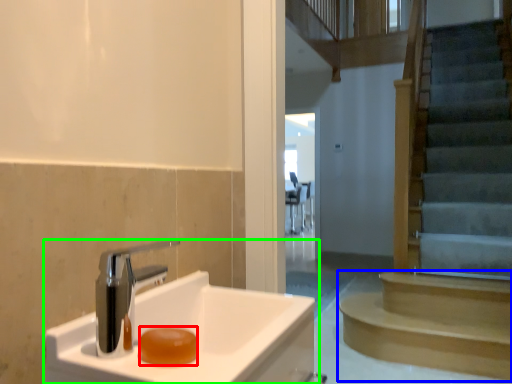
Question: Estimate the real-world distances between objects in this image. Which object is farther from soap (highlighted by a red box), stairs (highlighted by a blue box) or sink (highlighted by a green box)?

Choices:
 (A) stairs
 (B) sink

Answer: (A)